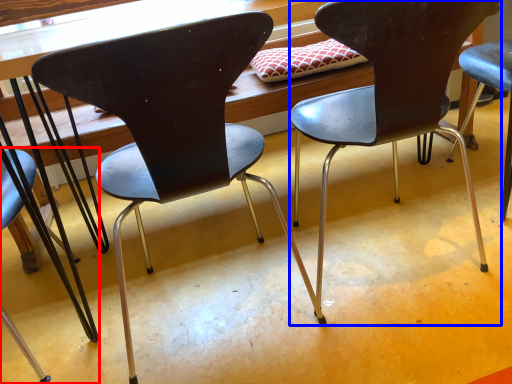
Question: Which object appears closest to the camera in this image, chair (highlighted by a red box) or chair (highlighted by a blue box)?

Choices:
 (A) chair
 (B) chair

Answer: (B)